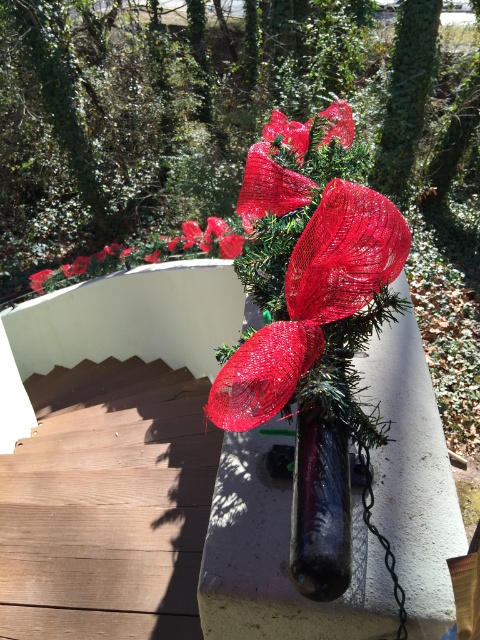
Question: Is brown wooden stairs at lower left wider than shiny red ribbon at center?

Choices:
 (A) yes
 (B) no

Answer: (A)

Question: Which point appears farthest from the camera in this image?

Choices:
 (A) (259, 355)
 (B) (199, 428)

Answer: (B)

Question: Does brown wooden stairs at lower left come in front of shiny red ribbon at center?

Choices:
 (A) yes
 (B) no

Answer: (B)

Question: Does brown wooden stairs at lower left appear over shiny red ribbon at center?

Choices:
 (A) no
 (B) yes

Answer: (A)

Question: Among these objects, which one is farthest from the camera?

Choices:
 (A) brown wooden stairs at lower left
 (B) shiny red ribbon at center

Answer: (A)

Question: Which point is farther to the camera?

Choices:
 (A) (321, 227)
 (B) (91, 605)

Answer: (B)